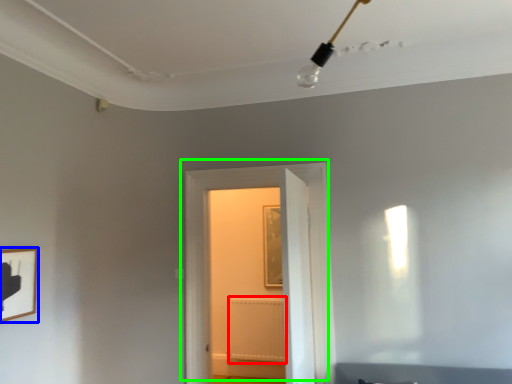
Question: Which is farther away from radiator (highlighted by a red box)? picture frame (highlighted by a blue box) or door (highlighted by a green box)?

Choices:
 (A) picture frame
 (B) door

Answer: (A)